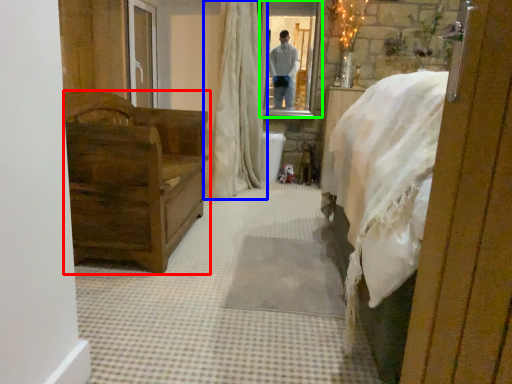
Question: Which is farther away from furniture (highlighted by a red box)? curtain (highlighted by a blue box) or mirror (highlighted by a green box)?

Choices:
 (A) curtain
 (B) mirror

Answer: (B)